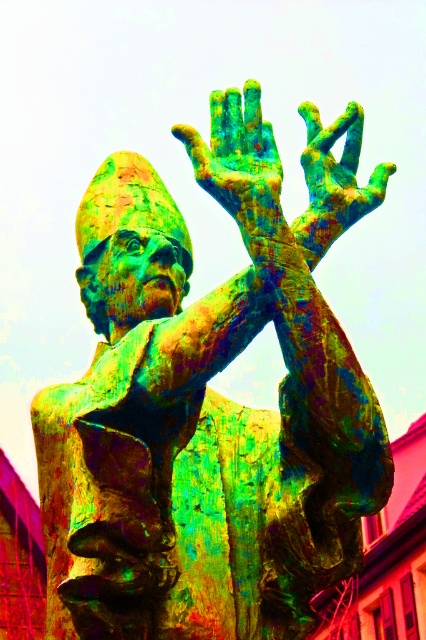
You are an art conservator examining the statue of the bishop. You notice a specific point on the statue where the patina has started to flake. This point is at coordinates point (238, 161). Which part of the statue is this point most likely located on?

The bronze textured hand at upper center is located at point (238, 161), so the flaking patina is most likely on the bronze textured hand at upper center.